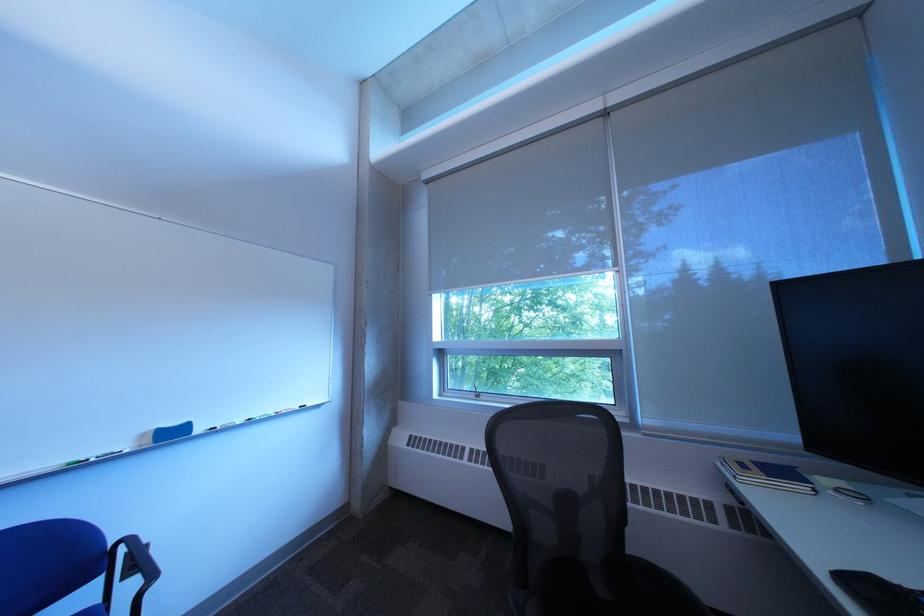
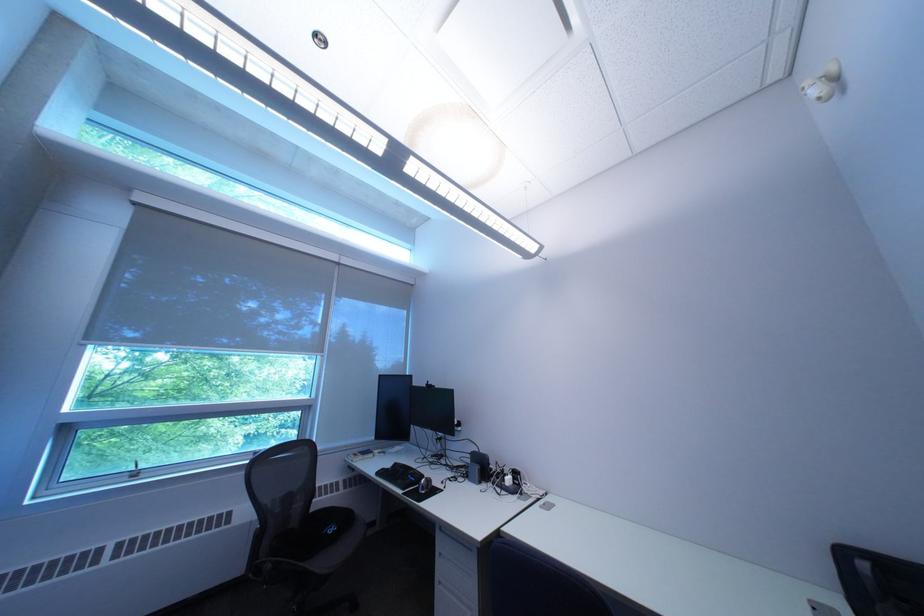
In the second image, find the point that corresponds to point 860,582 in the first image.

(393, 475)